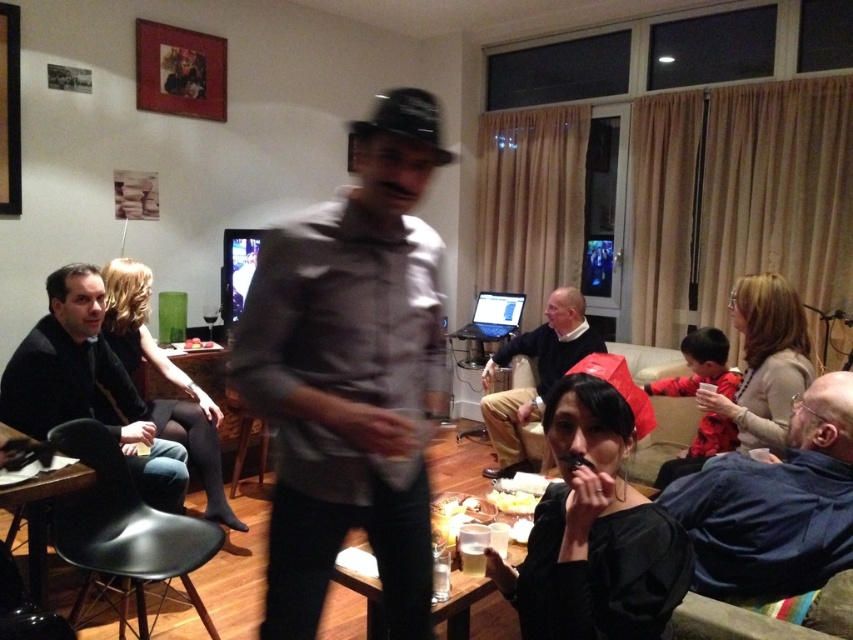
Question: Can you confirm if gray matte shirt at center is bigger than blue denim shirt at lower right?

Choices:
 (A) yes
 (B) no

Answer: (B)

Question: Considering the real-world distances, which object is closest to the black leather jacket at lower left?

Choices:
 (A) yellow matte cheese at center
 (B) blue denim shirt at lower right
 (C) gray matte shirt at center

Answer: (A)

Question: Does gray matte shirt at center appear on the left side of black leather jacket at lower left?

Choices:
 (A) no
 (B) yes

Answer: (A)

Question: Among these objects, which one is farthest from the camera?

Choices:
 (A) yellow matte cheese at center
 (B) smooth black shirt at center
 (C) gray matte shirt at center
 (D) blue denim shirt at lower right

Answer: (B)

Question: Can you confirm if gray matte shirt at center is smaller than smooth black shirt at center?

Choices:
 (A) yes
 (B) no

Answer: (A)

Question: Which point is farther to the camera?

Choices:
 (A) (306, 548)
 (B) (503, 492)
 (C) (548, 376)
 (D) (791, 506)

Answer: (C)